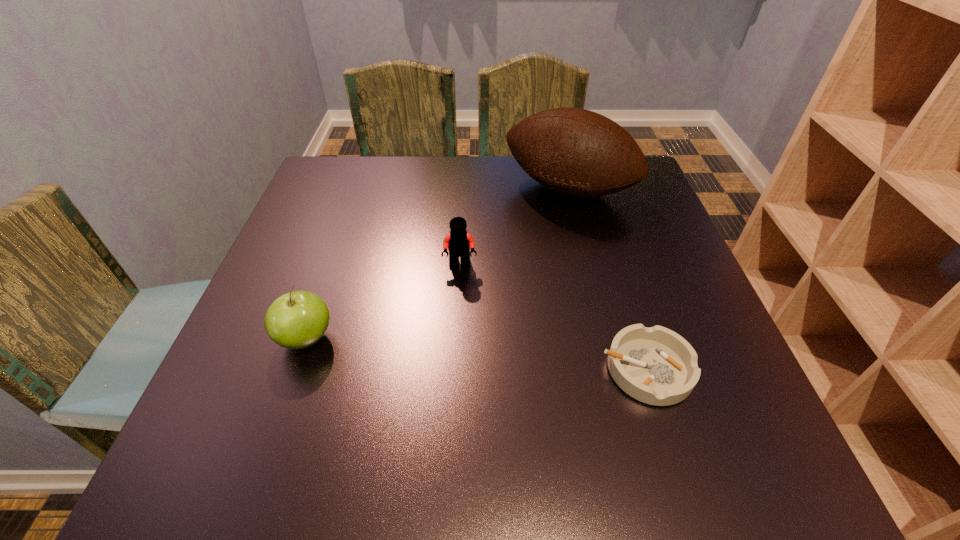
Find the location of a particular element. This screenshot has height=540, width=960. the leftmost object is located at coordinates (298, 319).

The image size is (960, 540). What are the coordinates of `the shortest object` in the screenshot? It's located at (657, 366).

Locate an element on the screen. This screenshot has height=540, width=960. the farthest object is located at coordinates (x=576, y=152).

Where is `football`? The height and width of the screenshot is (540, 960). football is located at coordinates (576, 152).

I want to click on the second object from left to right, so click(x=458, y=242).

Image resolution: width=960 pixels, height=540 pixels. What are the coordinates of `Lego` in the screenshot? It's located at (458, 242).

Where is `vacant space located on the back of the leftmost object`? vacant space located on the back of the leftmost object is located at coordinates (354, 200).

The height and width of the screenshot is (540, 960). I want to click on free space located 0.080m on the back of the ashtray, so pos(626,305).

Find the location of `free location located on the laces of the farthest object`. free location located on the laces of the farthest object is located at coordinates (523, 244).

The height and width of the screenshot is (540, 960). In order to click on free space located on the laces of the farthest object in this screenshot , I will do `click(515, 256)`.